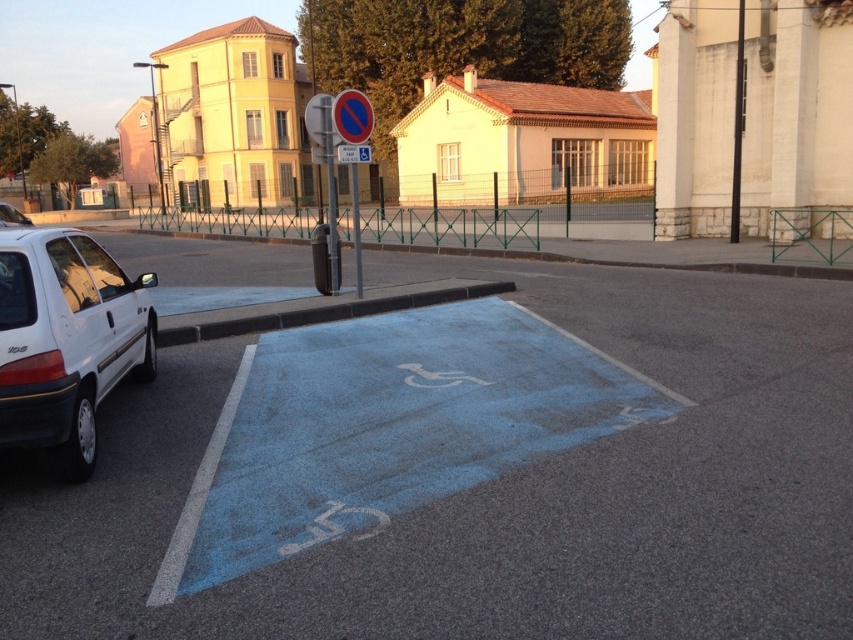
You are standing on the sidewalk and want to cross the street to reach a store located across the street. The blue asphalt bike lane at lower left is the closest path to the crosswalk. Can you safely walk to the crosswalk without crossing the bike lane?

The blue asphalt bike lane at lower left and viewer are 6.54 meters apart. Since the bike lane is the closest path to the crosswalk, you can safely walk to the crosswalk without crossing the bike lane as long as you stay on the sidewalk and follow the path towards the crosswalk.

You are a delivery driver who needs to park your van, which is 2 meters wide, in the parking area. The blue asphalt bike lane at lower left and the white matte hatchback at left are in your way. Can you fit your van between them?

The blue asphalt bike lane at lower left occupies less space than the white matte hatchback at left. Since the bike lane is narrower, the space between them may not be sufficient for a 2 meter wide van. You should look for another parking spot.

You are a delivery person on a bike, and you need to reach the blue asphalt bike lane at lower left. You are currently at point (387,428). Can you start your journey from here?

Yes, you can start your journey from point (387,428) because the blue asphalt bike lane at lower left is located exactly at that point.